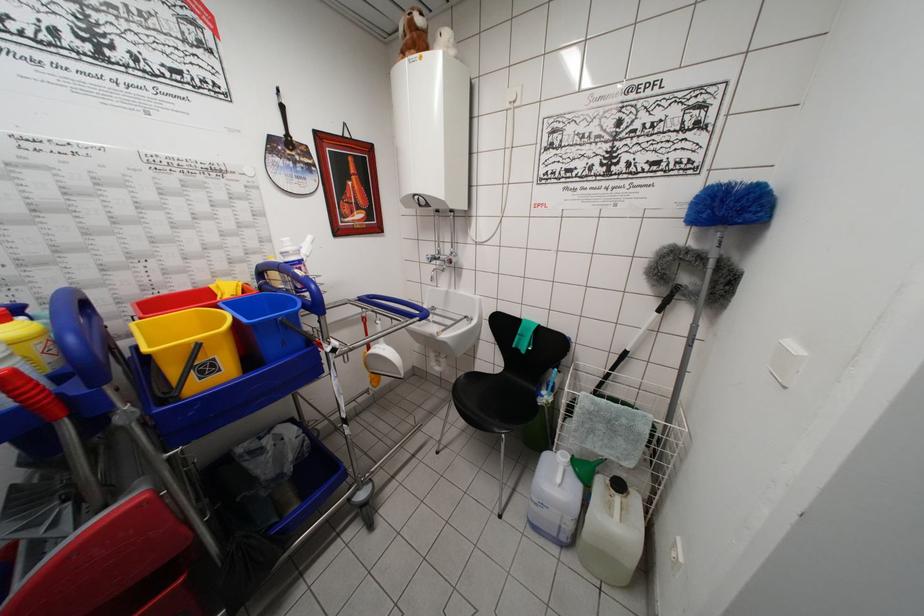
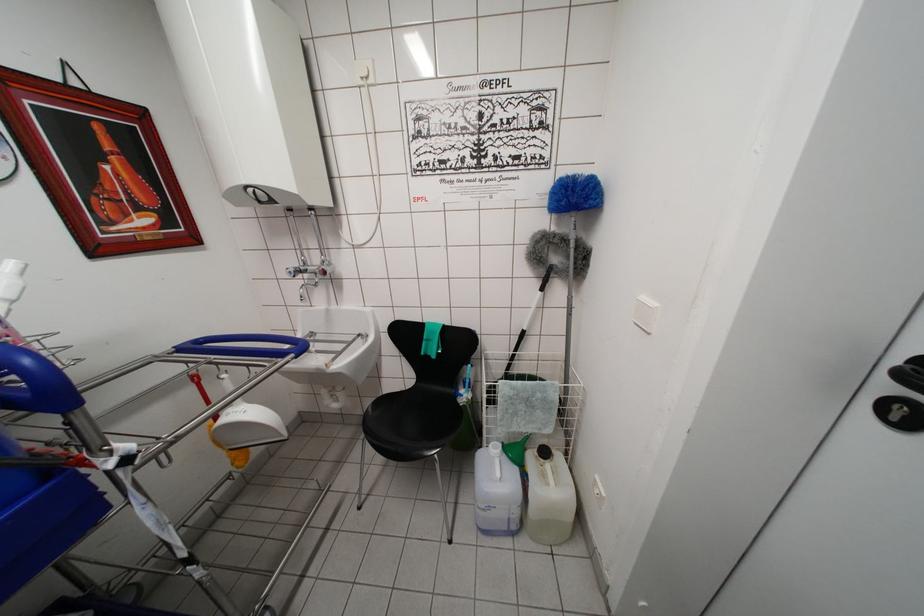
The point at (640, 496) is marked in the first image. Where is the corresponding point in the second image?

(561, 455)